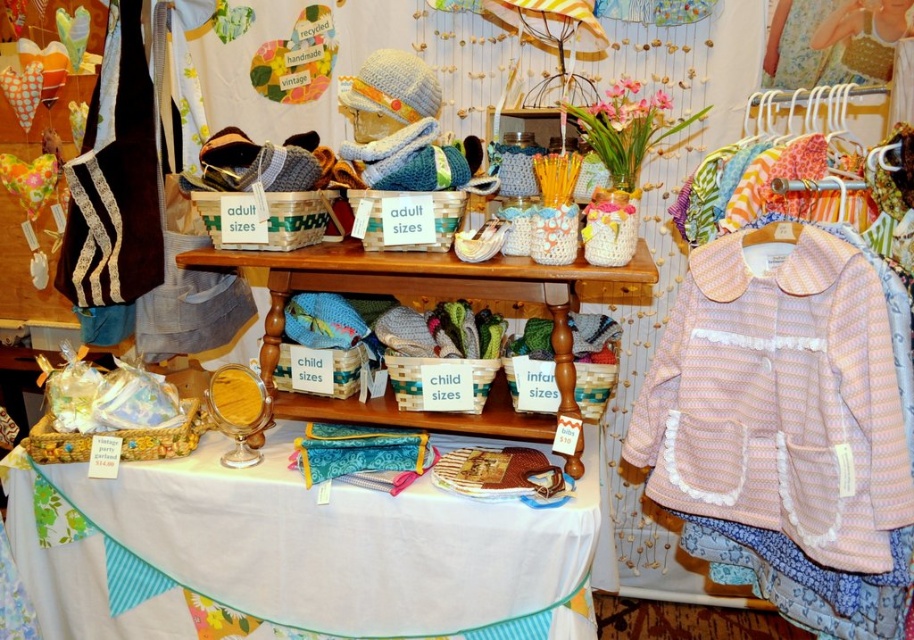
You are a customer at the craft fair and want to know which item is taller between the teal fabric purse at lower center and the floral fabric dress at upper right. Can you tell me?

The teal fabric purse at lower center has a greater height compared to the floral fabric dress at upper right, so the teal fabric purse at lower center is taller.

You are setting up a display at a craft fair and have a limited space between two shelves. The space is exactly the width of the brown velvet bag at left. Can you place the pink striped fabric jacket at center in this space without folding it?

The pink striped fabric jacket at center might be wider than brown velvet bag at left, so there is a possibility it won not fit in the space designed for the brown velvet bag at left. Check the width before placing it.